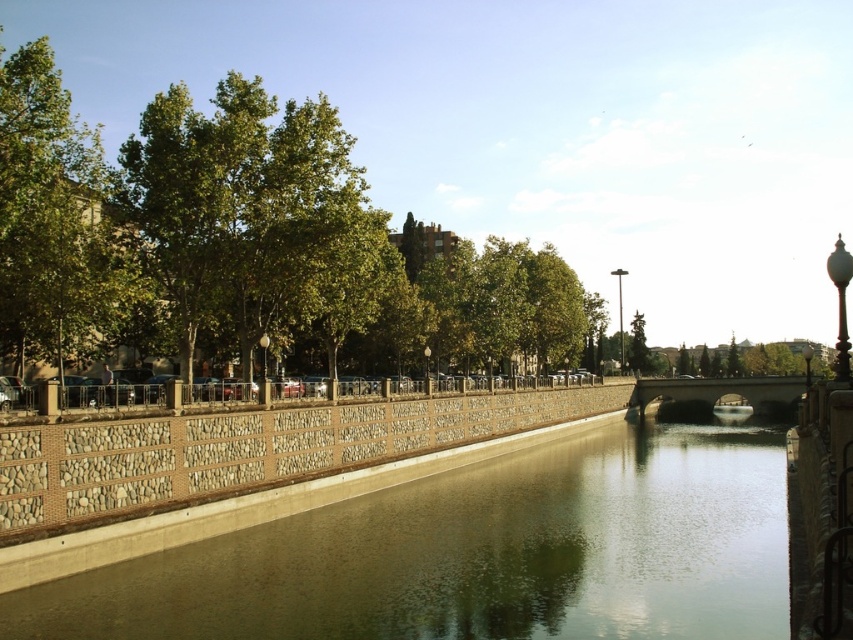
You are standing at the riverside and want to take a photo of both the smooth concrete river at center and the brown stone fence at center. Which object should you focus on first to ensure both are in clear view?

You should focus on the smooth concrete river at center first since it is closer to the viewer than the brown stone fence at center. By focusing on the closer object, the fence will also be in acceptable focus due to the depth of field.